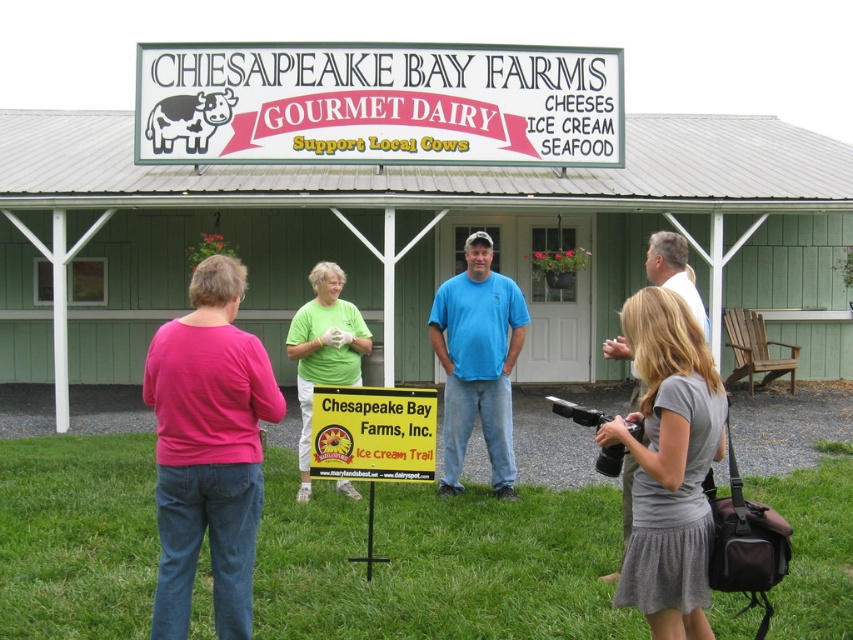
Does point (259, 449) lie behind point (485, 403)?

No, it is not.

Can you confirm if pink fabric shirt at center is positioned to the right of blue cotton shirt at center?

Incorrect, pink fabric shirt at center is not on the right side of blue cotton shirt at center.

Image resolution: width=853 pixels, height=640 pixels. I want to click on pink fabric shirt at center, so tap(207, 449).

Where is `pink fabric shirt at center`? This screenshot has width=853, height=640. pink fabric shirt at center is located at coordinates (207, 449).

Between blue cotton shirt at center and white cotton shirt at center, which one is positioned lower?

blue cotton shirt at center

Between point (468, 433) and point (624, 509), which one is positioned in front?

Point (624, 509)

Does point (486, 417) come closer to viewer compared to point (639, 380)?

No, it is behind (639, 380).

Where is `blue cotton shirt at center`? blue cotton shirt at center is located at coordinates (477, 362).

Is point (469, 333) in front of point (387, 420)?

That is False.

Who is more distant from viewer, (491, 323) or (378, 403)?

The point (491, 323) is more distant.

Who is more forward, (428, 314) or (425, 429)?

Point (425, 429)

The image size is (853, 640). I want to click on blue cotton shirt at center, so click(x=477, y=362).